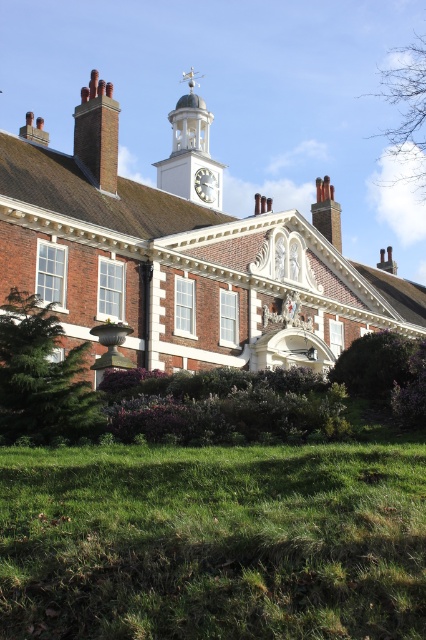
You are a maintenance worker needing to reach the white glossy clock at center from the purple leafy hedge at lower center. Given that your ladder can extend up to 40 meters, do you have sufficient reach to climb from the hedge to the clock?

The distance between the purple leafy hedge at lower center and the white glossy clock at center is 43.91 meters. Since your ladder only extends to 40 meters, it is insufficient to reach the clock from the hedge.

You are an architect reviewing the building plans. You notice two elements on the roof area. Which one is taller between the bare branches at upper right and the brick chimney at upper left?

The bare branches at upper right are taller than the brick chimney at upper left.

You are standing in front of the historic building and want to take a photo of the white glossy clock tower at upper center and the brick chimney at upper left. Which object should you focus on first to ensure both are in frame without moving the camera?

You should focus on the white glossy clock tower at upper center first because it is closer to you than the brick chimney at upper left, so keeping it centered will ensure both remain in frame without needing to adjust the camera position.